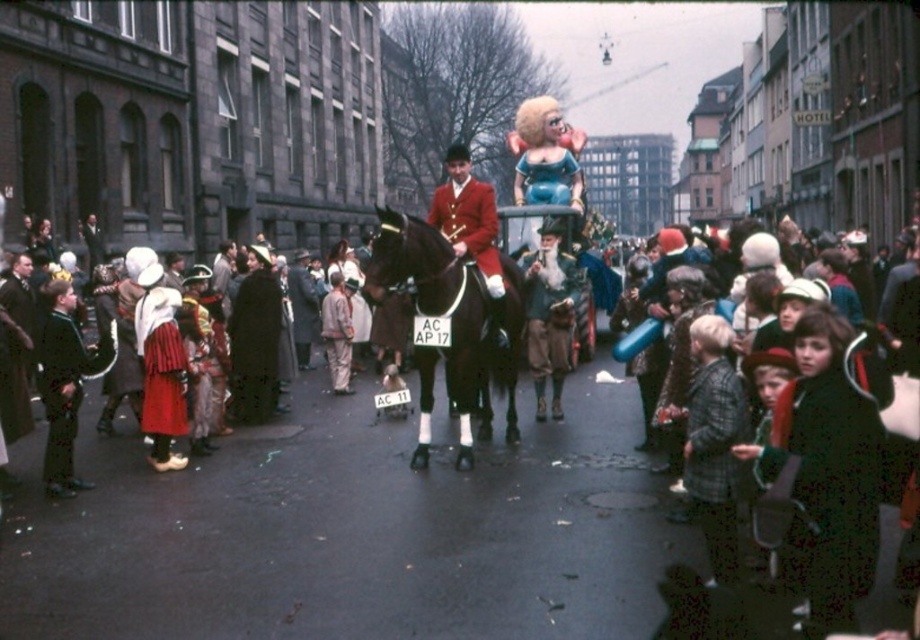
Question: Is the position of red woolen coat at left more distant than that of matte plastic teddy bear at center?

Choices:
 (A) yes
 (B) no

Answer: (B)

Question: Is shiny black horse at center above red woolen coat at left?

Choices:
 (A) no
 (B) yes

Answer: (A)

Question: Which of these objects is positioned farthest from the plaid wool jacket at lower right?

Choices:
 (A) dark brown leather coat at center
 (B) shiny black horse at center

Answer: (A)

Question: Which object is the farthest from the matte plastic teddy bear at center?

Choices:
 (A) red woolen coat at left
 (B) dark green wool coat at lower right
 (C) red velvet santa claus at center
 (D) shiny black horse at center

Answer: (C)

Question: Observing the image, what is the correct spatial positioning of shiny black horse at center in reference to red woolen coat at left?

Choices:
 (A) left
 (B) right

Answer: (B)

Question: Which of the following is the closest to the observer?

Choices:
 (A) coord(75,426)
 (B) coord(700,465)
 (C) coord(493,324)
 (D) coord(561,116)

Answer: (B)